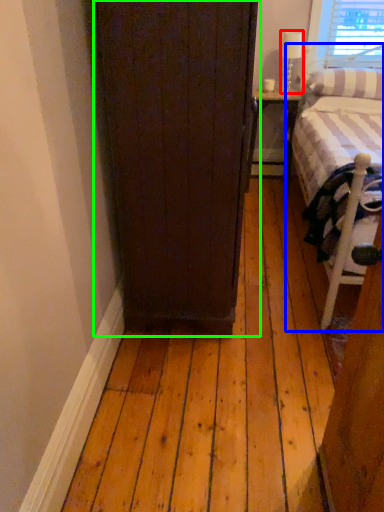
Question: Estimate the real-world distances between objects in this image. Which object is farther from lamp (highlighted by a red box), bed (highlighted by a blue box) or door (highlighted by a green box)?

Choices:
 (A) bed
 (B) door

Answer: (B)